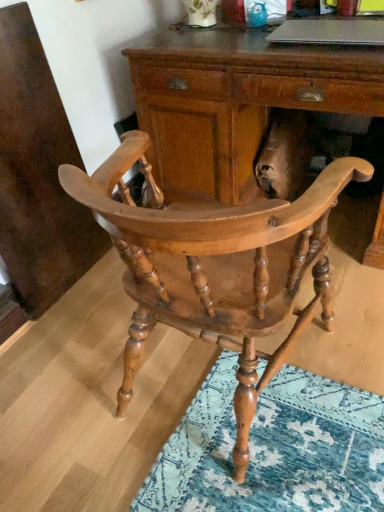
Question: Does natural wood chair at center have a smaller size compared to wooden desk at center?

Choices:
 (A) yes
 (B) no

Answer: (A)

Question: Is natural wood chair at center not close to wooden desk at center?

Choices:
 (A) yes
 (B) no

Answer: (B)

Question: From a real-world perspective, is natural wood chair at center physically below wooden desk at center?

Choices:
 (A) yes
 (B) no

Answer: (B)

Question: From the image's perspective, is natural wood chair at center under wooden desk at center?

Choices:
 (A) no
 (B) yes

Answer: (B)

Question: Is natural wood chair at center wider than wooden desk at center?

Choices:
 (A) no
 (B) yes

Answer: (A)

Question: Is natural wood chair at center closer to the viewer compared to wooden desk at center?

Choices:
 (A) yes
 (B) no

Answer: (A)

Question: Is natural wood chair at center at the back of silver metallic laptop at upper center?

Choices:
 (A) yes
 (B) no

Answer: (B)

Question: Considering the relative sizes of silver metallic laptop at upper center and natural wood chair at center in the image provided, is silver metallic laptop at upper center shorter than natural wood chair at center?

Choices:
 (A) yes
 (B) no

Answer: (A)

Question: Can you confirm if silver metallic laptop at upper center is positioned to the left of natural wood chair at center?

Choices:
 (A) yes
 (B) no

Answer: (B)

Question: Considering the relative sizes of silver metallic laptop at upper center and natural wood chair at center in the image provided, is silver metallic laptop at upper center taller than natural wood chair at center?

Choices:
 (A) no
 (B) yes

Answer: (A)

Question: Is there a large distance between silver metallic laptop at upper center and natural wood chair at center?

Choices:
 (A) yes
 (B) no

Answer: (B)

Question: From the image's perspective, does silver metallic laptop at upper center appear higher than natural wood chair at center?

Choices:
 (A) no
 (B) yes

Answer: (B)

Question: Can natural wood chair at center be found inside wooden desk at center?

Choices:
 (A) no
 (B) yes

Answer: (A)